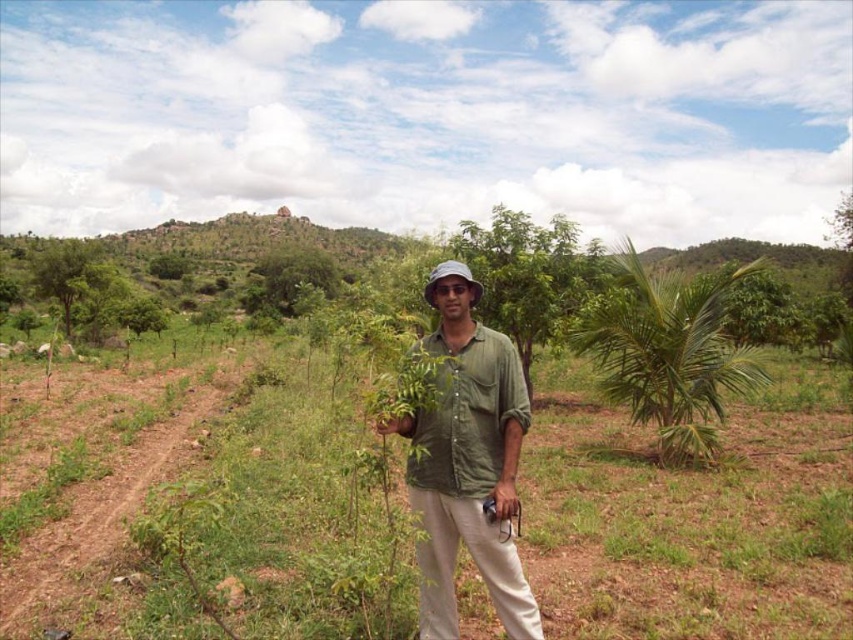
Between brown soil at center and green leafy tree at center, which one is positioned higher?

green leafy tree at center

Can you confirm if brown soil at center is positioned below green leafy tree at center?

Indeed, brown soil at center is positioned under green leafy tree at center.

Does point (263, 412) lie behind point (267, 307)?

No.

You are a GUI agent. You are given a task and a screenshot of the screen. Output one action in this format:
    pyautogui.click(x=<x>, y=<y>)
    Task: Click on the brown soil at center
    The height and width of the screenshot is (640, 853).
    Given the screenshot: What is the action you would take?
    (201, 502)

Between green matte shirt at center and green leafy tree at center, which one is positioned higher?

green leafy tree at center is higher up.

Can you confirm if green matte shirt at center is smaller than green leafy tree at center?

Yes.

Describe the element at coordinates (467, 461) in the screenshot. I see `green matte shirt at center` at that location.

Find the location of a particular element. This screenshot has width=853, height=640. green matte shirt at center is located at coordinates (467, 461).

Is green leafy palm at right positioned in front of green leafy tree at center?

That is True.

Based on the photo, is green leafy palm at right to the left of green leafy tree at center from the viewer's perspective?

In fact, green leafy palm at right is to the right of green leafy tree at center.

Between point (601, 332) and point (281, 301), which one is positioned in front?

Point (601, 332)

Locate an element on the screen. green leafy palm at right is located at coordinates (666, 352).